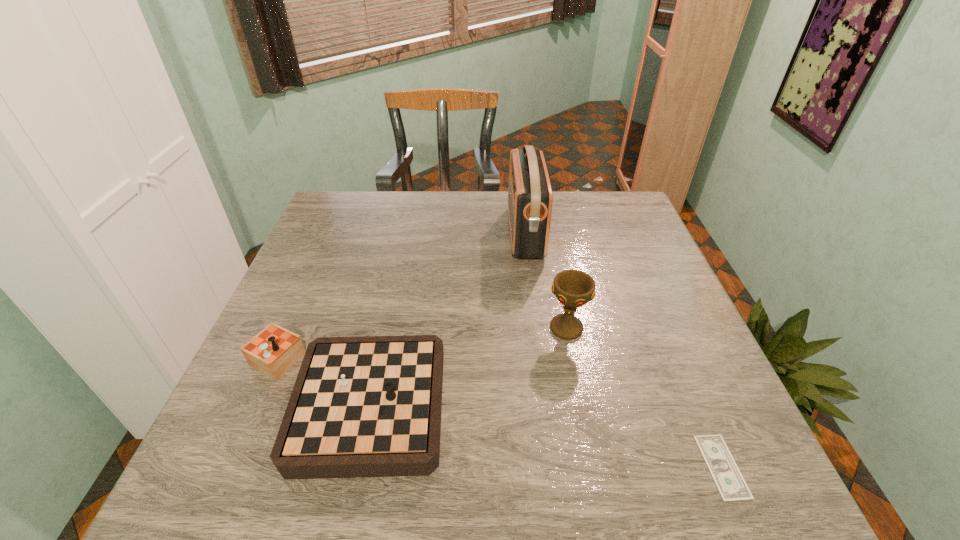
At what (x,y) coordinates should I click in order to perform the action: click on vacant region at the far edge. Please return your answer as a coordinate pair (x, y). This screenshot has width=960, height=540. Looking at the image, I should click on (489, 212).

Locate an element on the screen. free location at the near edge is located at coordinates (479, 481).

What are the coordinates of `vacant space at the right edge` in the screenshot? It's located at (707, 360).

Find the location of a particular element. This screenshot has height=540, width=960. vacant space at the far left corner is located at coordinates (371, 197).

The height and width of the screenshot is (540, 960). In the image, there is a desktop. What are the coordinates of `blank space at the far right corner` in the screenshot? It's located at (618, 194).

Identify the location of vacant area that lies between the chalice and the shortest object. Image resolution: width=960 pixels, height=540 pixels. (644, 397).

The height and width of the screenshot is (540, 960). I want to click on vacant point located between the chalice and the tallest object, so click(545, 280).

I want to click on empty space between the chalice and the second shortest object, so pyautogui.click(x=452, y=364).

Identify the location of vacant area between the second tallest object and the chessboard. (452, 364).

Where is `blank region between the farthest object and the leftmost object`? The width and height of the screenshot is (960, 540). blank region between the farthest object and the leftmost object is located at coordinates (431, 316).